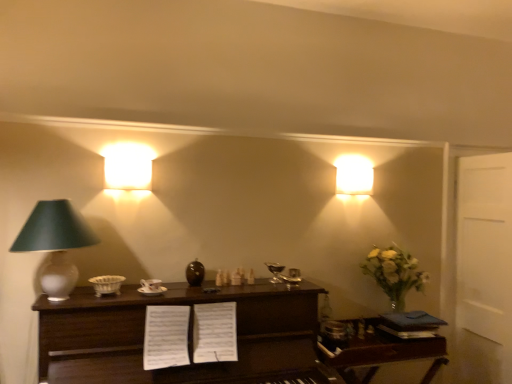
Question: Is dark wood table at center, positioned as the 1th table in left-to-right order, shorter than matte white lampshade at upper left, marked as the second lamp in a front-to-back arrangement?

Choices:
 (A) yes
 (B) no

Answer: (B)

Question: From the image's perspective, does dark wood table at center, positioned as the second table in right-to-left order, appear higher than matte white lampshade at upper left, the second lamp from the back?

Choices:
 (A) no
 (B) yes

Answer: (A)

Question: From a real-world perspective, is dark wood table at center, positioned as the 1th table in left-to-right order, on top of matte white lampshade at upper left, the 2th lamp from the left?

Choices:
 (A) yes
 (B) no

Answer: (B)

Question: Is the surface of dark wood table at center, positioned as the 1th table in left-to-right order, in direct contact with matte white lampshade at upper left, the 2th lamp from the left?

Choices:
 (A) yes
 (B) no

Answer: (B)

Question: Are dark wood table at center, positioned as the second table in right-to-left order, and matte white lampshade at upper left, which ranks as the 2th lamp in right-to-left order, located far from each other?

Choices:
 (A) yes
 (B) no

Answer: (B)

Question: From a real-world perspective, relative to dark wood table at center, positioned as the second table in right-to-left order, is matte white lampshade at upper left, the second lamp from the back, vertically above or below?

Choices:
 (A) above
 (B) below

Answer: (A)

Question: Based on their positions, is matte white lampshade at upper left, the second lamp from the back, located to the left or right of dark wood table at center, positioned as the second table in right-to-left order?

Choices:
 (A) right
 (B) left

Answer: (B)

Question: Does point (117, 158) appear closer or farther from the camera than point (267, 347)?

Choices:
 (A) closer
 (B) farther

Answer: (B)

Question: Is matte white lampshade at upper left, marked as the second lamp in a front-to-back arrangement, in front of or behind dark wood table at center, positioned as the second table in right-to-left order, in the image?

Choices:
 (A) behind
 (B) front

Answer: (A)

Question: In terms of width, does matte white lamp at left, placed as the 3th lamp when sorted from back to front, look wider or thinner when compared to wooden table at right, which is the 1th table in right-to-left order?

Choices:
 (A) thin
 (B) wide

Answer: (A)

Question: Relative to wooden table at right, the 2th table viewed from the left, is matte white lamp at left, placed as the 3th lamp when sorted from back to front, in front or behind?

Choices:
 (A) behind
 (B) front

Answer: (B)

Question: Is matte white lamp at left, the 3th lamp in the right-to-left sequence, taller or shorter than wooden table at right, which is the 1th table in right-to-left order?

Choices:
 (A) tall
 (B) short

Answer: (A)

Question: From a real-world perspective, is matte white lamp at left, the 3th lamp in the right-to-left sequence, above or below wooden table at right, the 2th table viewed from the left?

Choices:
 (A) below
 (B) above

Answer: (B)

Question: In terms of width, does matte white lamp at left, placed as the 3th lamp when sorted from back to front, look wider or thinner when compared to matte white lampshade at upper left, marked as the second lamp in a front-to-back arrangement?

Choices:
 (A) wide
 (B) thin

Answer: (A)

Question: Considering their positions, is matte white lamp at left, the 3th lamp in the right-to-left sequence, located in front of or behind matte white lampshade at upper left, the 2th lamp from the left?

Choices:
 (A) behind
 (B) front

Answer: (B)